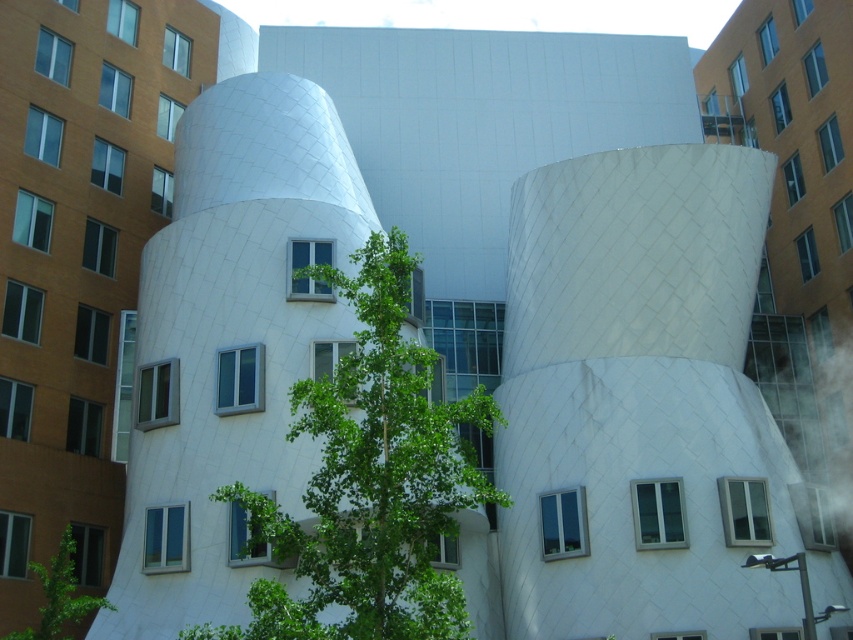
Question: Which of the following is the closest to the observer?

Choices:
 (A) green leafy tree at lower left
 (B) green leafy tree at center

Answer: (B)

Question: Can you confirm if green leafy tree at center is wider than green leafy tree at lower left?

Choices:
 (A) yes
 (B) no

Answer: (A)

Question: Does green leafy tree at center lie in front of green leafy tree at lower left?

Choices:
 (A) yes
 (B) no

Answer: (A)

Question: Which object appears closest to the camera in this image?

Choices:
 (A) green leafy tree at center
 (B) green leafy tree at lower left

Answer: (A)

Question: Does green leafy tree at center have a smaller size compared to green leafy tree at lower left?

Choices:
 (A) yes
 (B) no

Answer: (B)

Question: Which of the following is the farthest from the observer?

Choices:
 (A) green leafy tree at center
 (B) green leafy tree at lower left

Answer: (B)